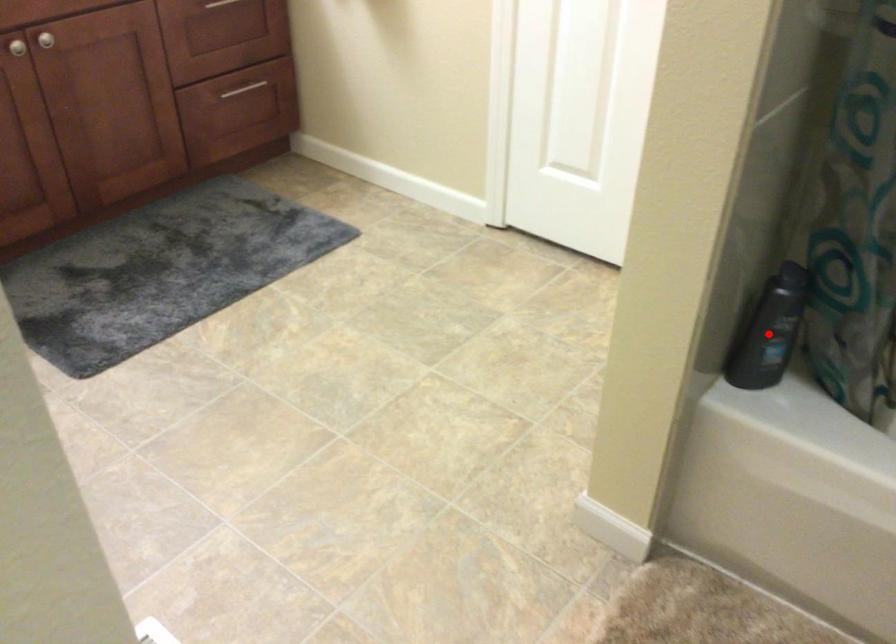
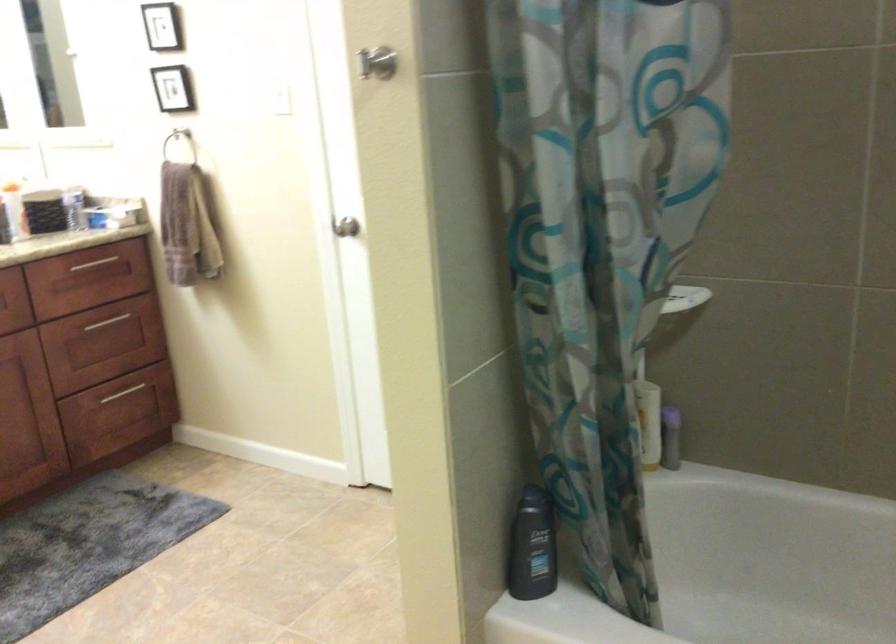
Where in the second image is the point corresponding to the highlighted location from the first image?

(531, 547)